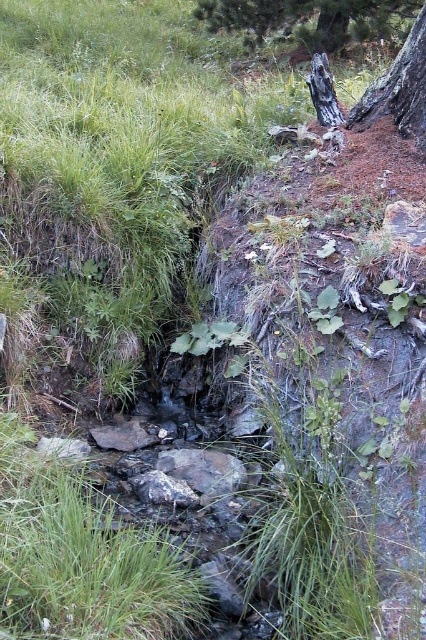
You are standing in the middle of the stream and want to reach the green textured tree at upper center and the smooth bark tree trunk at upper right. Which tree is wider in terms of its base?

The green textured tree at upper center is wider than the smooth bark tree trunk at upper right.

You are standing at the point marked as point (308, 19) in the image. What is the immediate surface you are standing on?

The immediate surface you are standing on is the green textured tree at upper center.

Consider the image. You are standing at the edge of the stream and want to take a photo of both the green textured tree at upper center and the smooth bark tree trunk at upper right. Which tree should you focus on first if you want to capture both in the same frame?

You should focus on the green textured tree at upper center first because it is closer to you than the smooth bark tree trunk at upper right, which is taller and might be further away.